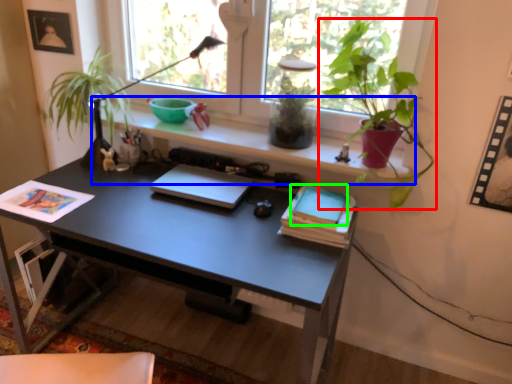
Question: Based on their relative distances, which object is farther from houseplant (highlighted by a red box)? Choose from window sill (highlighted by a blue box) and paperback book (highlighted by a green box).

Choices:
 (A) window sill
 (B) paperback book

Answer: (B)